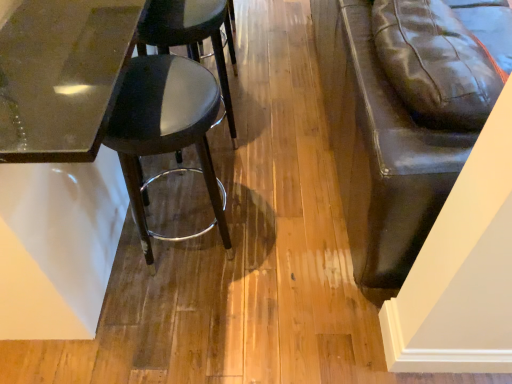
Locate an element on the screen. The image size is (512, 384). free space that is in between black leather stool at center, the second stool from the bottom, and matte black stool at left, which is the first stool from bottom to top is located at coordinates (188, 189).